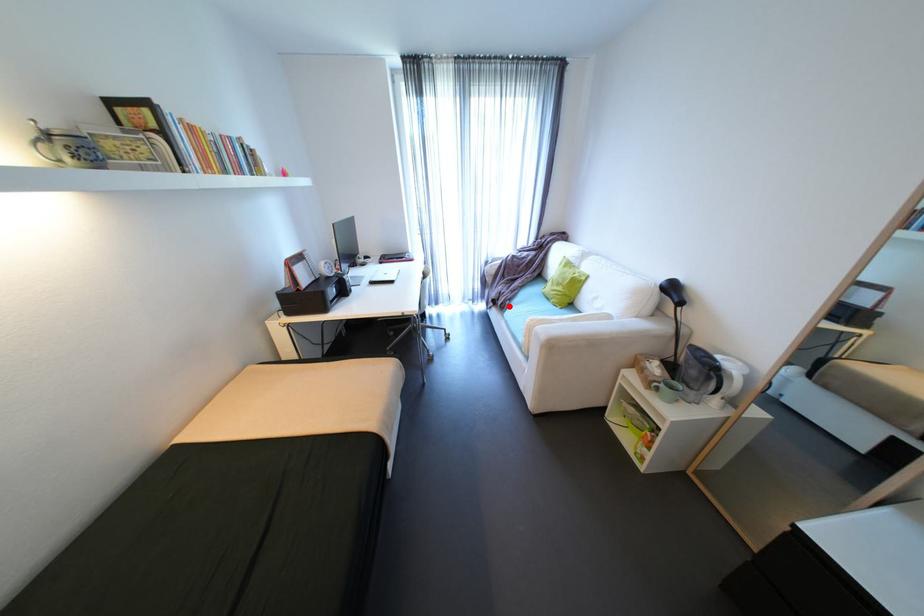
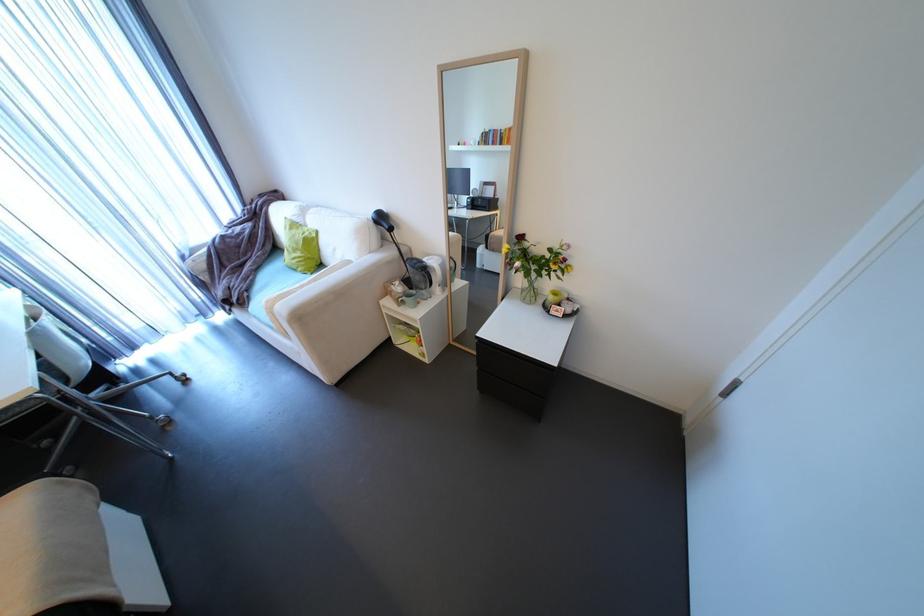
The point at the highlighted location is marked in the first image. Where is the corresponding point in the second image?

(248, 302)